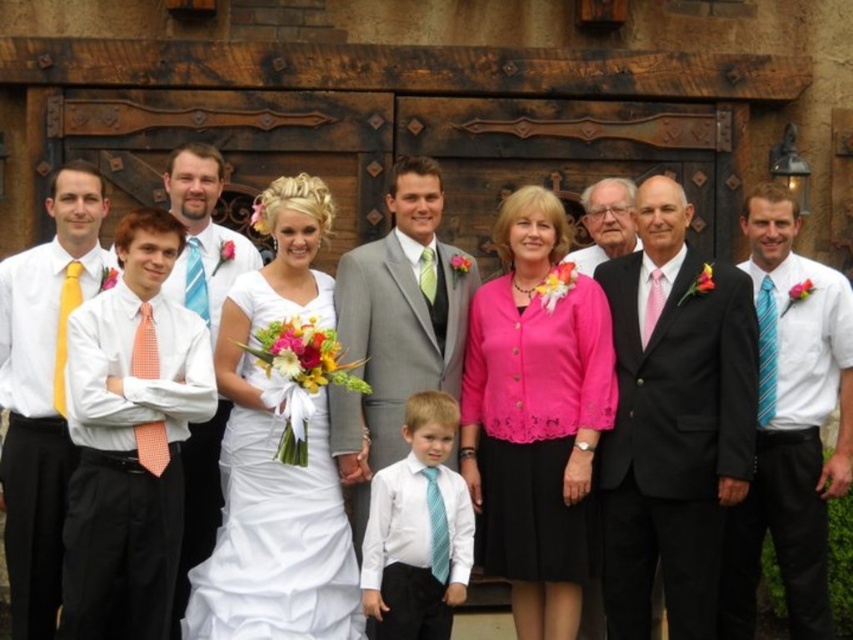
Question: Estimate the real-world distances between objects in this image. Which object is closer to the blue striped tie at center?

Choices:
 (A) green silk tie at center
 (B) checkered fabric shirt at left
 (C) pink satin tie at center-right

Answer: (B)

Question: Where is matte yellow tie at left located in relation to yellow satin tie at left in the image?

Choices:
 (A) above
 (B) below

Answer: (B)

Question: Which object is positioned farthest from the pink satin tie at center-right?

Choices:
 (A) white satin dress at center
 (B) matte yellow tie at left
 (C) matte orange tie at left
 (D) matte black suit at center

Answer: (B)

Question: Does pink fabric dress at center come behind white striped tie at right?

Choices:
 (A) no
 (B) yes

Answer: (A)

Question: Is pink fabric dress at center wider than blue striped tie at center?

Choices:
 (A) yes
 (B) no

Answer: (A)

Question: Among these points, which one is nearest to the camera?

Choices:
 (A) (67, 266)
 (B) (601, 240)
 (C) (532, 310)

Answer: (A)